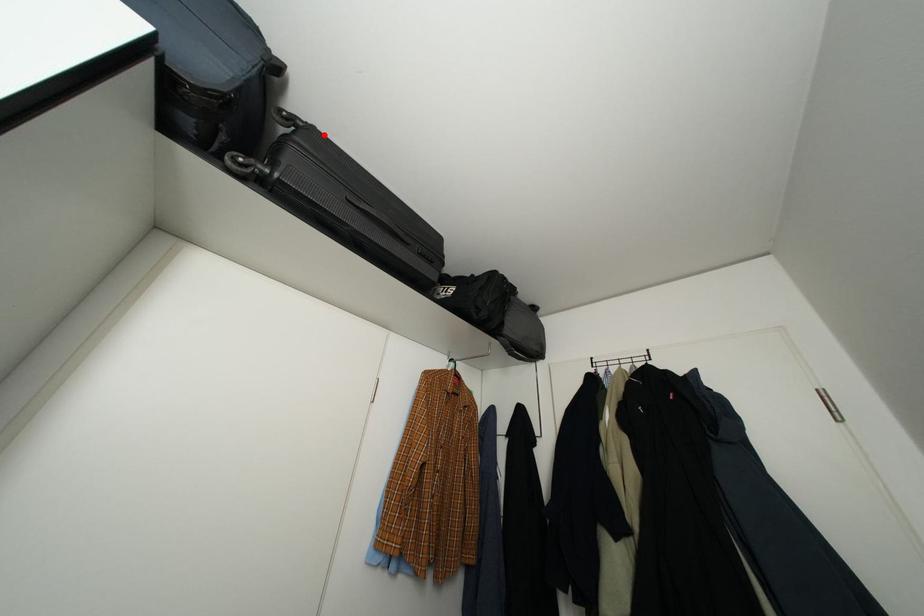
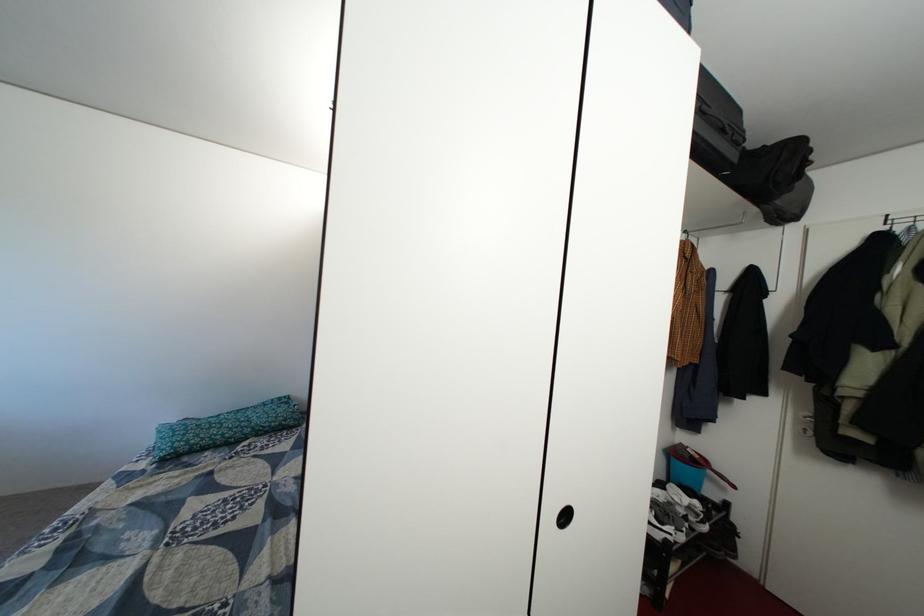
Question: I am providing you with two images of the same scene from different viewpoints. A red point is marked on the first image. Is the red point's position out of view in image 2?

Choices:
 (A) Yes
 (B) No

Answer: (A)